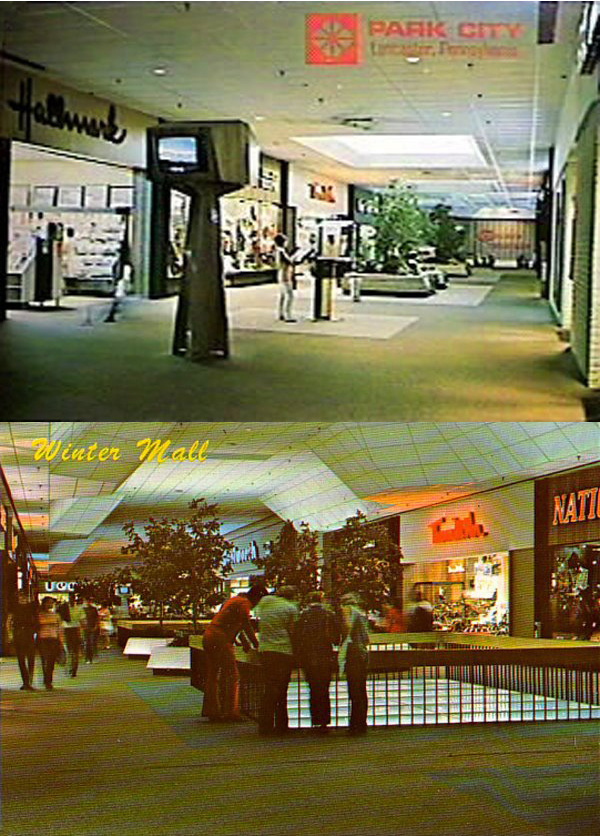
I want to click on photographs, so click(312, 263), click(323, 746).